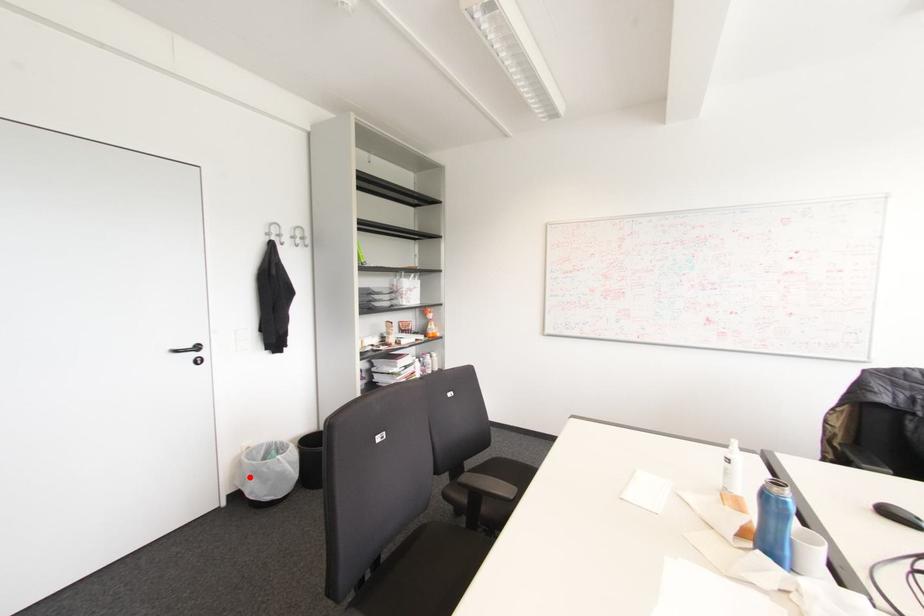
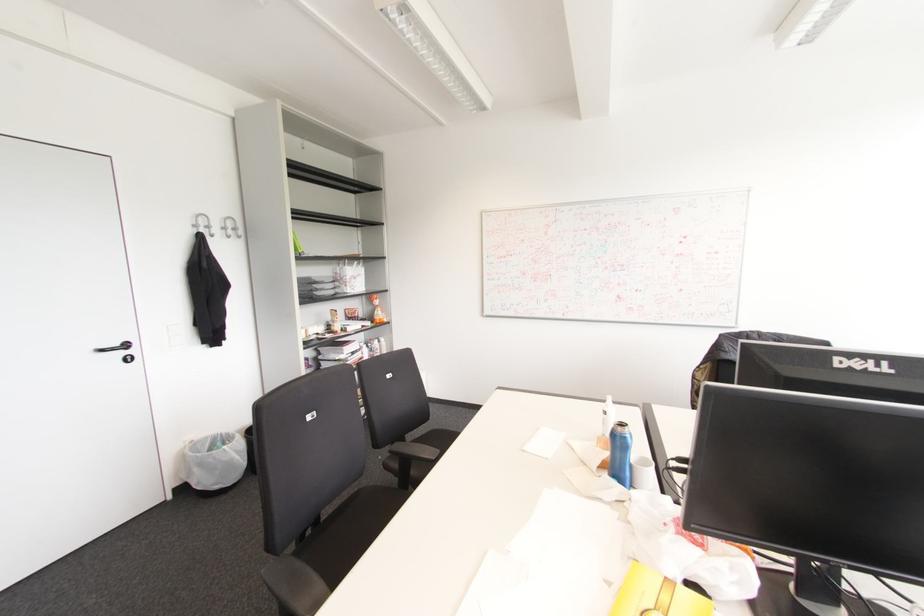
Question: I am providing you with two images of the same scene from different viewpoints. In image1, a red point is highlighted. Considering the same 3D point in image2, which of the following is correct?

Choices:
 (A) It is closer
 (B) It is farther

Answer: (A)